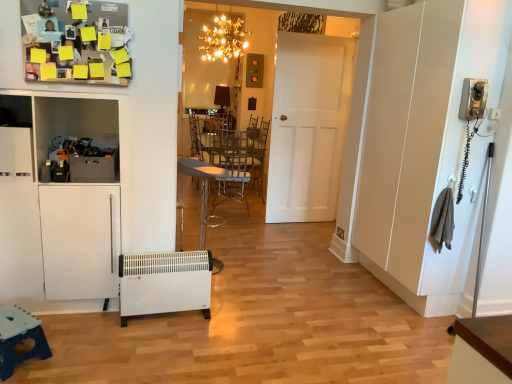
This screenshot has width=512, height=384. Find the location of `blue plastic table at lower left, which is the 2th table from top to bottom`. blue plastic table at lower left, which is the 2th table from top to bottom is located at coordinates (19, 338).

You are a GUI agent. You are given a task and a screenshot of the screen. Output one action in this format:
    pyautogui.click(x=<x>, y=<y>)
    Task: Click on the metallic silver chair at center
    The image size is (512, 384).
    Given the screenshot: What is the action you would take?
    pyautogui.click(x=201, y=184)

This screenshot has height=384, width=512. What do you see at coordinates (230, 151) in the screenshot?
I see `metallic silver table at center, positioned as the 1th table in top-to-bottom order` at bounding box center [230, 151].

Image resolution: width=512 pixels, height=384 pixels. What are the coordinates of `gold metallic chandelier at upper center` in the screenshot? It's located at (224, 39).

What do you see at coordinates (224, 39) in the screenshot? Image resolution: width=512 pixels, height=384 pixels. I see `gold metallic chandelier at upper center` at bounding box center [224, 39].

What are the coordinates of `white plastic heater at lower left` in the screenshot? It's located at (165, 283).

This screenshot has width=512, height=384. In order to click on appliance lying in front of the white matte door at center in this screenshot , I will do `click(165, 283)`.

Is point (300, 184) behind point (144, 273)?

Yes, it is behind point (144, 273).

Considering the sizes of white matte door at center and white plastic heater at lower left in the image, is white matte door at center bigger or smaller than white plastic heater at lower left?

Clearly, white matte door at center is larger in size than white plastic heater at lower left.

From a real-world perspective, is white matte door at center physically below white plastic heater at lower left?

No.

Considering the sizes of objects white plastic heater at lower left and metallic silver chair at center in the image provided, who is wider, white plastic heater at lower left or metallic silver chair at center?

Wider between the two is metallic silver chair at center.

Is white plastic heater at lower left bigger than metallic silver chair at center?

No, white plastic heater at lower left is not bigger than metallic silver chair at center.

Image resolution: width=512 pixels, height=384 pixels. I want to click on appliance located underneath the metallic silver chair at center (from a real-world perspective), so click(x=165, y=283).

How many degrees apart are the facing directions of white plastic heater at lower left and metallic silver chair at center?

The angle between the facing direction of white plastic heater at lower left and the facing direction of metallic silver chair at center is 75.3 degrees.

Locate an element on the screen. chair below the white matte door at center (from the image's perspective) is located at coordinates (201, 184).

From a real-world perspective, is metallic silver chair at center positioned under white matte door at center based on gravity?

Yes.

Does point (204, 223) appear closer or farther from the camera than point (338, 79)?

Clearly, point (204, 223) is closer to the camera than point (338, 79).

Is metallic silver chair at center bigger than white matte door at center?

Actually, metallic silver chair at center might be smaller than white matte door at center.

Considering the relative sizes of metallic silver table at center, which is the 2th table in left-to-right order, and blue plastic table at lower left, acting as the 1th table starting from the bottom, in the image provided, is metallic silver table at center, which is the 2th table in left-to-right order, wider than blue plastic table at lower left, acting as the 1th table starting from the bottom,?

Yes, metallic silver table at center, which is the 2th table in left-to-right order, is wider than blue plastic table at lower left, acting as the 1th table starting from the bottom.

From a real-world perspective, is metallic silver table at center, acting as the 1th table starting from the back, on blue plastic table at lower left, which is the 2th table from right to left?

Yes.

Considering the relative positions of metallic silver table at center, which ranks as the second table in front-to-back order, and blue plastic table at lower left, the first table from the front, in the image provided, is metallic silver table at center, which ranks as the second table in front-to-back order, behind blue plastic table at lower left, the first table from the front,?

Yes, metallic silver table at center, which ranks as the second table in front-to-back order, is further from the viewer.

Is white plastic heater at lower left oriented away from gold metallic chandelier at upper center?

That's not correct — white plastic heater at lower left is not looking away from gold metallic chandelier at upper center.

Based on the photo, considering the relative sizes of white plastic heater at lower left and gold metallic chandelier at upper center in the image provided, is white plastic heater at lower left taller than gold metallic chandelier at upper center?

Incorrect, the height of white plastic heater at lower left is not larger of that of gold metallic chandelier at upper center.

Considering the positions of objects white plastic heater at lower left and gold metallic chandelier at upper center in the image provided, who is more to the right, white plastic heater at lower left or gold metallic chandelier at upper center?

gold metallic chandelier at upper center is more to the right.

Can you see blue plastic table at lower left, which is the 1th table in left-to-right order, touching white matte door at center?

They are not placed beside each other.

Between blue plastic table at lower left, which is the 1th table in left-to-right order, and white matte door at center, which one is positioned in front?

blue plastic table at lower left, which is the 1th table in left-to-right order, is closer to the camera.

From the image's perspective, who appears lower, blue plastic table at lower left, which is the 1th table in left-to-right order, or white matte door at center?

blue plastic table at lower left, which is the 1th table in left-to-right order, is shown below in the image.

Identify the location of door located above the white plastic heater at lower left (from a real-world perspective). This screenshot has width=512, height=384. (308, 126).

Is white plastic heater at lower left bigger than white matte door at center?

No, white plastic heater at lower left is not bigger than white matte door at center.

Considering the sizes of white plastic heater at lower left and white matte door at center in the image, is white plastic heater at lower left taller or shorter than white matte door at center?

In the image, white plastic heater at lower left appears to be shorter than white matte door at center.

The width and height of the screenshot is (512, 384). What are the coordinates of `door lying on the right of white plastic heater at lower left` in the screenshot? It's located at (308, 126).

At what (x,y) coordinates should I click in order to perform the action: click on appliance located below the metallic silver chair at center (from the image's perspective). Please return your answer as a coordinate pair (x, y). Looking at the image, I should click on (165, 283).

From the image, which object appears to be nearer to metallic silver chair at center, blue plastic table at lower left, the first table from the front, or metallic silver table at center, which ranks as the second table in front-to-back order?

metallic silver table at center, which ranks as the second table in front-to-back order, lies closer to metallic silver chair at center than the other object.

Based on their spatial positions, is white matte door at center or blue plastic table at lower left, which is the 2th table from top to bottom, further from metallic silver table at center, placed as the 1th table when sorted from right to left?

blue plastic table at lower left, which is the 2th table from top to bottom, is further to metallic silver table at center, placed as the 1th table when sorted from right to left.

Based on their spatial positions, is blue plastic table at lower left, which is the 2th table from right to left, or gold metallic chandelier at upper center closer to metallic silver chair at center?

Among the two, gold metallic chandelier at upper center is located nearer to metallic silver chair at center.

Looking at the image, which one is located further to metallic silver table at center, which ranks as the second table in bottom-to-top order, metallic silver chair at center or gold metallic chandelier at upper center?

gold metallic chandelier at upper center.

Considering their positions, is gold metallic chandelier at upper center positioned closer to blue plastic table at lower left, which is the 2th table from right to left, than white matte door at center?

white matte door at center.

Which object lies further to the anchor point metallic silver chair at center, white plastic heater at lower left or metallic silver table at center, which ranks as the second table in front-to-back order?

white plastic heater at lower left.

From the image, which object appears to be farther from white matte door at center, metallic silver table at center, acting as the 1th table starting from the back, or gold metallic chandelier at upper center?

gold metallic chandelier at upper center is positioned further to the anchor white matte door at center.

Looking at the image, which one is located closer to metallic silver table at center, positioned as the 1th table in top-to-bottom order, blue plastic table at lower left, which is the 2th table from back to front, or gold metallic chandelier at upper center?

gold metallic chandelier at upper center.

You are a GUI agent. You are given a task and a screenshot of the screen. Output one action in this format:
    pyautogui.click(x=<x>, y=<y>)
    Task: Click on the chair between blue plastic table at lower left, which is the 2th table from top to bottom, and white matte door at center from front to back
    Image resolution: width=512 pixels, height=384 pixels.
    Given the screenshot: What is the action you would take?
    pyautogui.click(x=201, y=184)

Find the location of `door between white plastic heater at lower left and metallic silver table at center, placed as the 1th table when sorted from right to left, along the z-axis`. door between white plastic heater at lower left and metallic silver table at center, placed as the 1th table when sorted from right to left, along the z-axis is located at coordinates [308, 126].

What are the coordinates of `appliance between blue plastic table at lower left, which is the 2th table from right to left, and metallic silver table at center, placed as the 1th table when sorted from right to left, from front to back` in the screenshot? It's located at (165, 283).

Locate an element on the screen. The image size is (512, 384). appliance positioned between blue plastic table at lower left, which is the 1th table in left-to-right order, and white matte door at center from near to far is located at coordinates (165, 283).